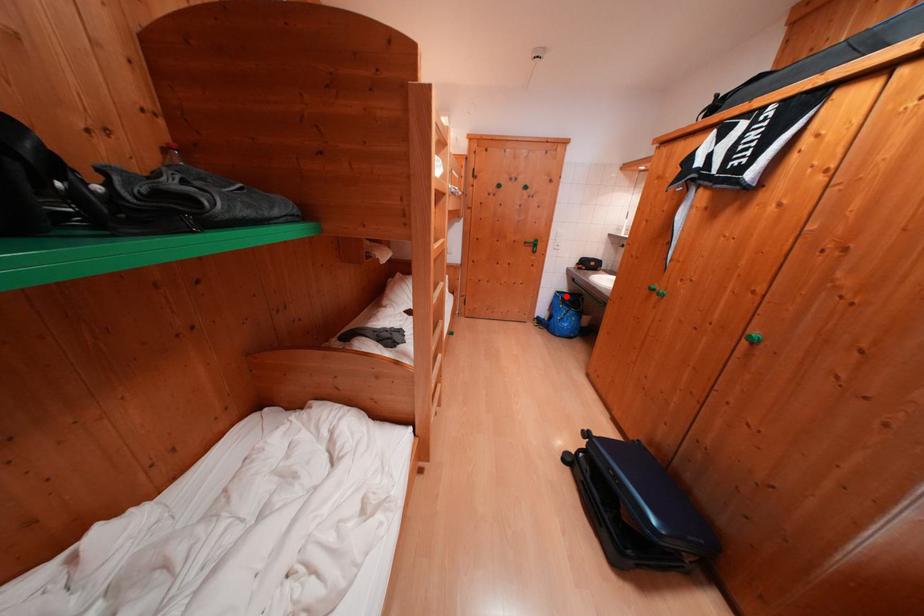
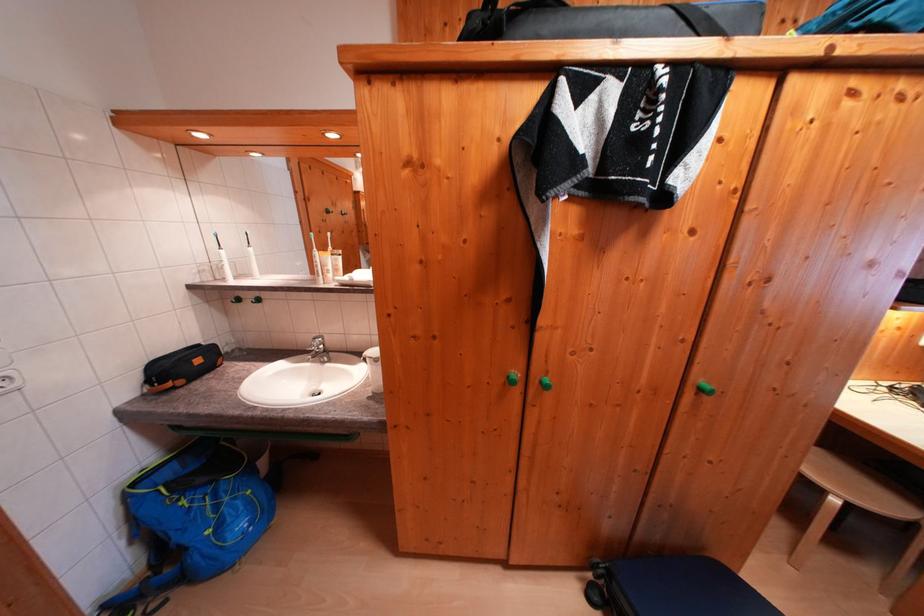
Question: I am providing you with two images of the same scene from different viewpoints. In image1, a red point is highlighted. Considering the same 3D point in image2, which of the following is correct?

Choices:
 (A) It is closer
 (B) It is farther

Answer: (B)